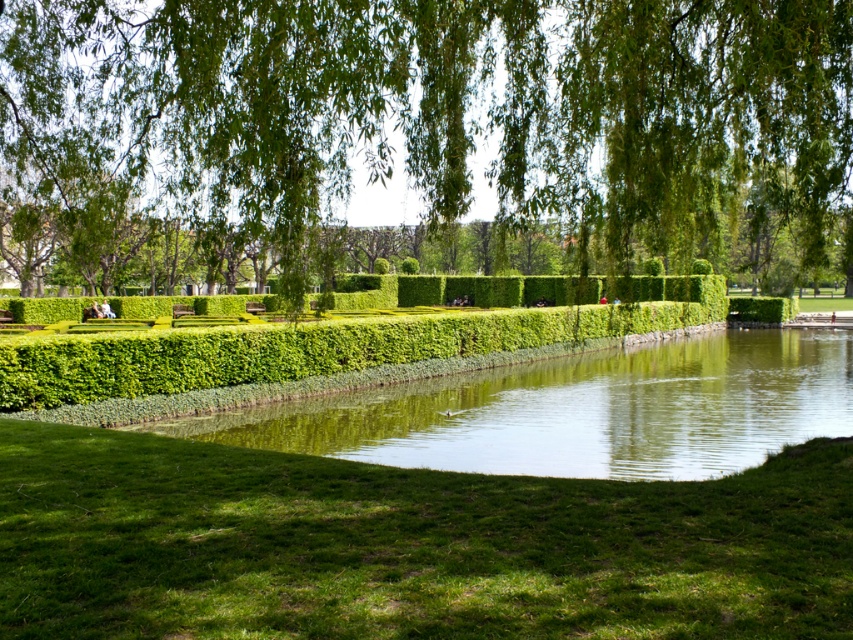
From the picture: Is green grass at lower center taller than green smooth water at center?

In fact, green grass at lower center may be shorter than green smooth water at center.

You are a GUI agent. You are given a task and a screenshot of the screen. Output one action in this format:
    pyautogui.click(x=<x>, y=<y>)
    Task: Click on the green grass at lower center
    The width and height of the screenshot is (853, 640).
    Given the screenshot: What is the action you would take?
    pyautogui.click(x=407, y=545)

Between green leafy willow at upper center and green smooth water at center, which one is positioned higher?

green leafy willow at upper center

Find the location of a particular element. This screenshot has height=640, width=853. green leafy willow at upper center is located at coordinates (422, 140).

Find the location of `green leafy willow at upper center`. green leafy willow at upper center is located at coordinates (422, 140).

Who is more distant from viewer, (845,394) or (473,344)?

Point (473,344)

Is green smooth water at center positioned behind green leafy hedge at center?

No, green smooth water at center is closer to the viewer.

Does point (671, 467) lie in front of point (200, 353)?

Yes, it is.

Where is `green smooth water at center`? This screenshot has width=853, height=640. green smooth water at center is located at coordinates point(578,412).